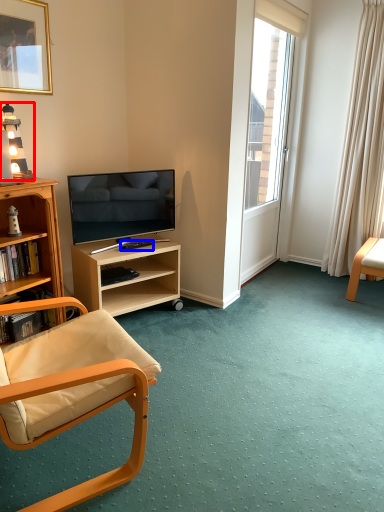
Question: Which object is closer to the camera taking this photo, lamp (highlighted by a red box) or remote control (highlighted by a blue box)?

Choices:
 (A) lamp
 (B) remote control

Answer: (A)